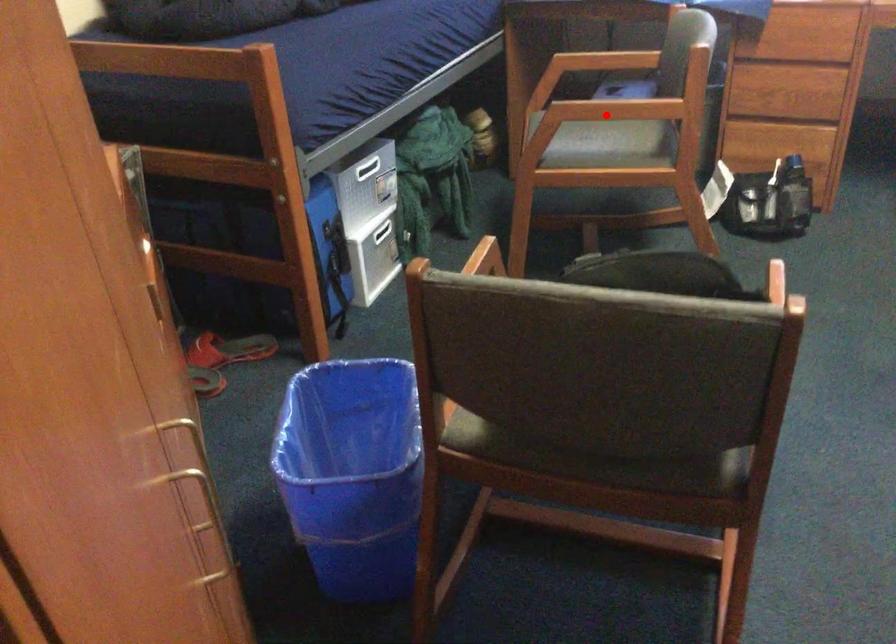
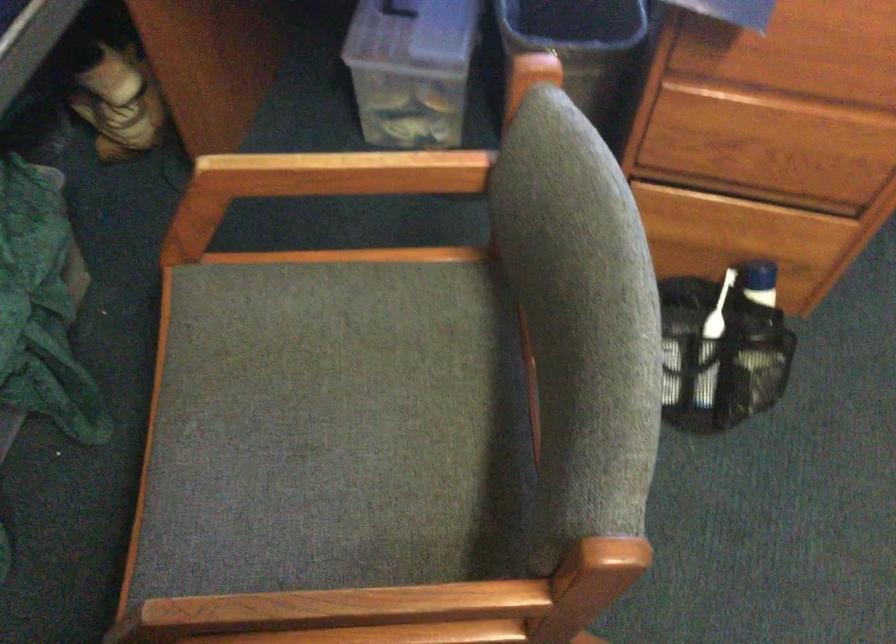
The point at the highlighted location is marked in the first image. Where is the corresponding point in the second image?

(338, 611)